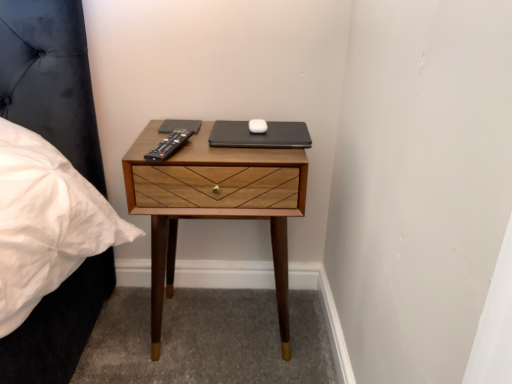
In order to click on vacant space situated on the left part of black matte laptop at center in this screenshot , I will do `click(178, 132)`.